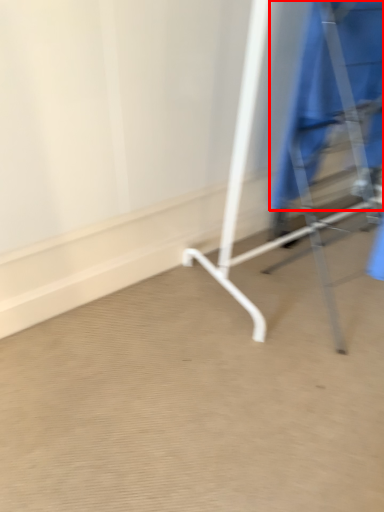
Question: From the image's perspective, considering the relative positions of robe (annotated by the red box) and furniture in the image provided, where is robe (annotated by the red box) located with respect to the staircase?

Choices:
 (A) below
 (B) above

Answer: (B)